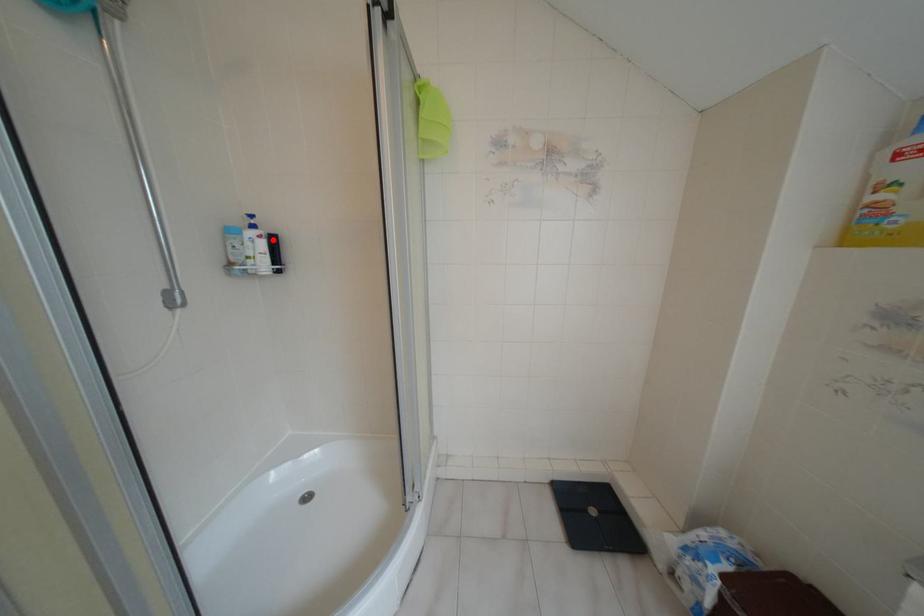
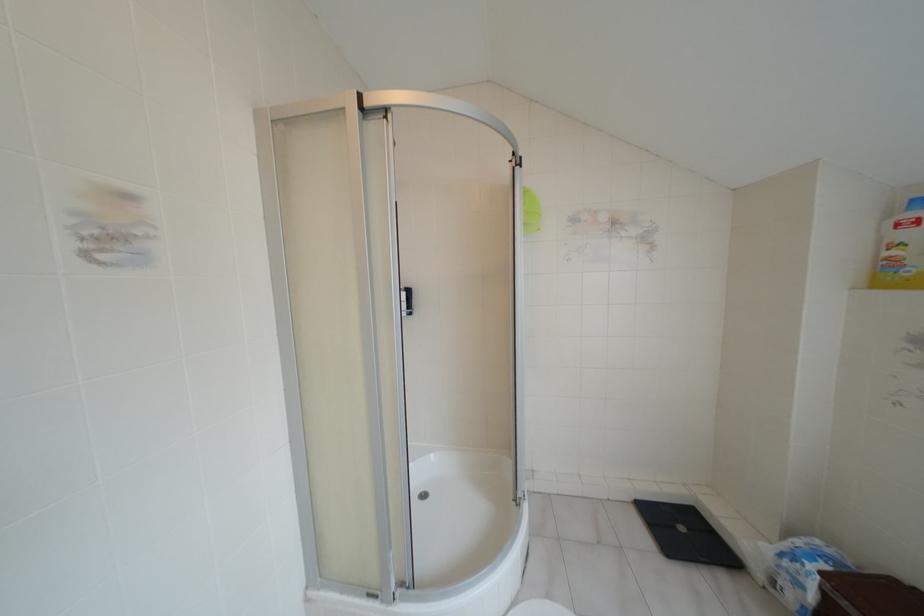
The point at the highlighted location is marked in the first image. Where is the corresponding point in the second image?

(407, 292)